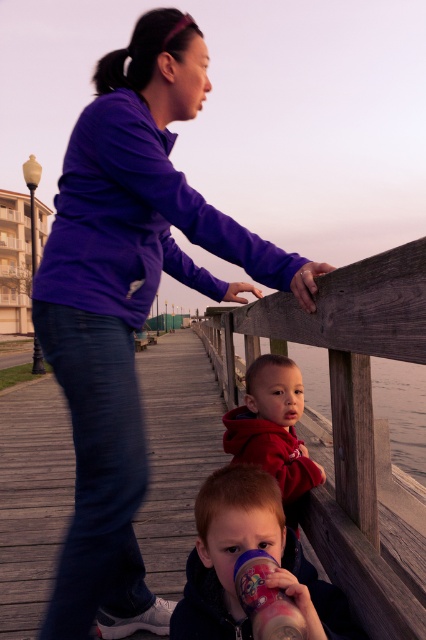
Measure the distance between point (414, 419) and camera.

A distance of 84.16 feet exists between point (414, 419) and camera.

Does transparent water at rail center appear on the right side of matte plastic sippy cup at lower center?

Yes, transparent water at rail center is to the right of matte plastic sippy cup at lower center.

What are the coordinates of `transparent water at rail center` in the screenshot? It's located at (402, 410).

Is dark blue fleece jacket at lower center taller than matte plastic sippy cup at lower center?

Yes, dark blue fleece jacket at lower center is taller than matte plastic sippy cup at lower center.

Is dark blue fleece jacket at lower center positioned in front of matte plastic sippy cup at lower center?

No.

Does point (204, 506) come closer to viewer compared to point (296, 621)?

No.

Where is `dark blue fleece jacket at lower center`? The image size is (426, 640). dark blue fleece jacket at lower center is located at coordinates (241, 552).

Is red fleece jacket at center positioned before transparent water at rail center?

No.

Is red fleece jacket at center bigger than transparent water at rail center?

No.

Identify the location of red fleece jacket at center. This screenshot has width=426, height=640. (273, 429).